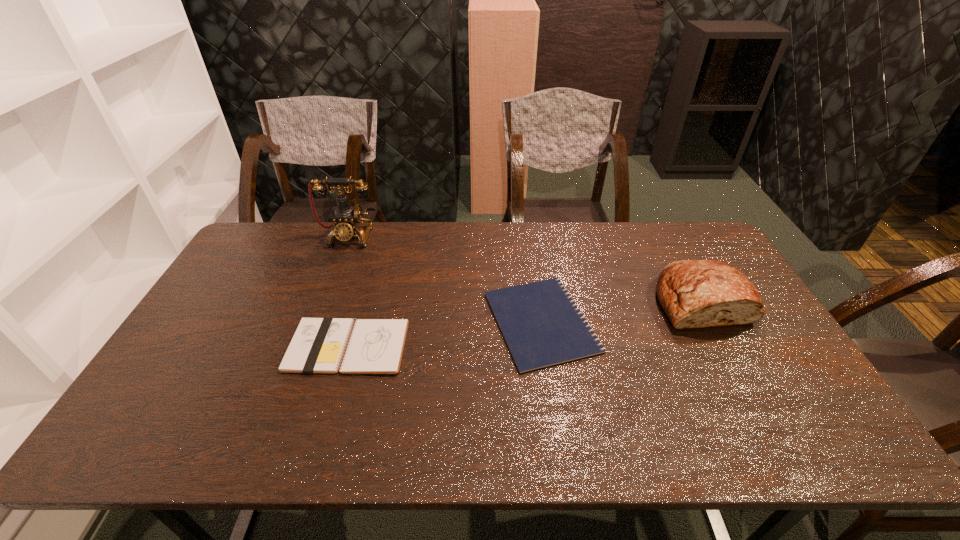
Where is `free space between the right notepad and the tallest object`? The image size is (960, 540). free space between the right notepad and the tallest object is located at coordinates (445, 279).

Locate an element on the screen. Image resolution: width=960 pixels, height=540 pixels. vacant space that is in between the shortest object and the third tallest object is located at coordinates (444, 334).

Where is `free spot between the shortest object and the third shortest object`? The image size is (960, 540). free spot between the shortest object and the third shortest object is located at coordinates (622, 312).

The width and height of the screenshot is (960, 540). I want to click on free area in between the tallest object and the rightmost object, so click(525, 269).

Locate an element on the screen. The width and height of the screenshot is (960, 540). free space between the tallest object and the second object from right to left is located at coordinates (445, 279).

I want to click on free spot between the second tallest object and the right notepad, so tap(622, 312).

The image size is (960, 540). I want to click on free spot between the taller notepad and the shorter notepad, so click(x=444, y=334).

Locate an element on the screen. The height and width of the screenshot is (540, 960). the second closest object relative to the rightmost object is located at coordinates (375, 346).

Identify which object is located as the third nearest to the shorter notepad. Please provide its 2D coordinates. Your answer should be formatted as a tuple, i.e. [(x, y)], where the tuple contains the x and y coordinates of a point satisfying the conditions above.

[(346, 219)]

Where is `vacant point that satisfies the following two spatial constraints: 1. on the front of the second shortest object, featuring the rotary dial; 2. on the right side of the telephone`? Image resolution: width=960 pixels, height=540 pixels. vacant point that satisfies the following two spatial constraints: 1. on the front of the second shortest object, featuring the rotary dial; 2. on the right side of the telephone is located at coordinates (307, 346).